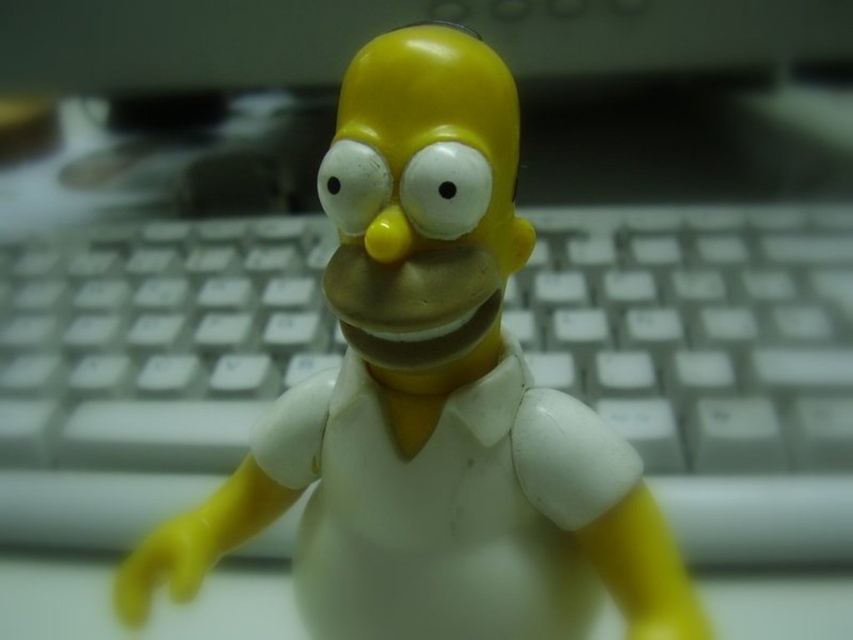
Is white plastic keyboard at center below yellow matte figure at center?

No, white plastic keyboard at center is not below yellow matte figure at center.

In order to click on white plastic keyboard at center in this screenshot , I will do `click(708, 362)`.

What do you see at coordinates (708, 362) in the screenshot? I see `white plastic keyboard at center` at bounding box center [708, 362].

I want to click on white plastic keyboard at center, so click(708, 362).